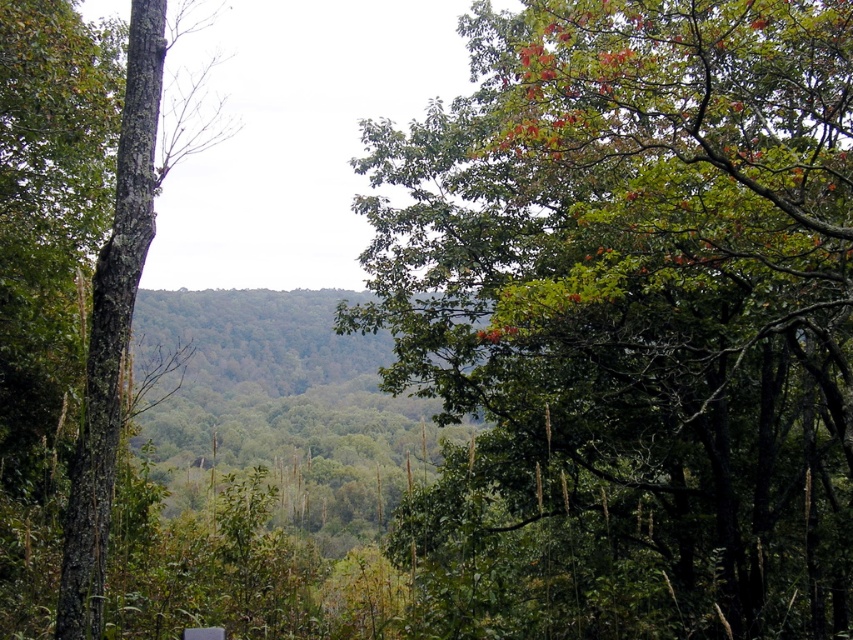
Based on the photo, can you confirm if green leafy tree at upper center is positioned below green rough bark tree at left?

Yes, green leafy tree at upper center is below green rough bark tree at left.

Is green leafy tree at upper center to the right of green rough bark tree at left from the viewer's perspective?

Yes, green leafy tree at upper center is to the right of green rough bark tree at left.

Where is `green leafy tree at upper center`? The height and width of the screenshot is (640, 853). green leafy tree at upper center is located at coordinates (643, 285).